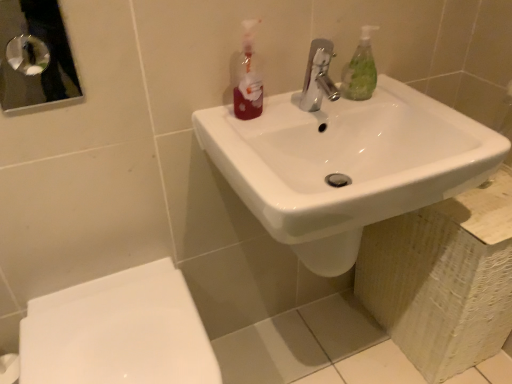
I want to click on free space between polished chrome faucet at center and translucent plastic bottle at upper center, so click(x=283, y=117).